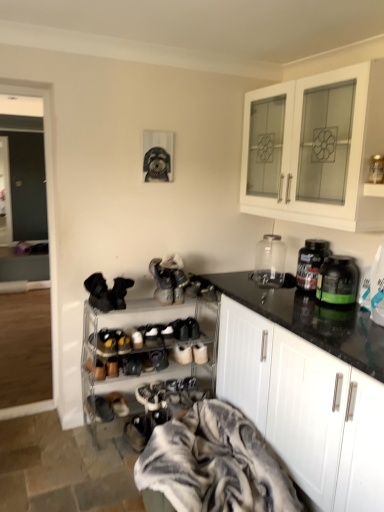
Question: Is metallic silver shoe rack at lower center shorter than white suede shoe at lower center, which is counted as the first shoe, starting from the bottom?

Choices:
 (A) yes
 (B) no

Answer: (B)

Question: Is metallic silver shoe rack at lower center not within white suede shoe at lower center, which is counted as the first shoe, starting from the bottom?

Choices:
 (A) no
 (B) yes

Answer: (B)

Question: Considering the relative sizes of metallic silver shoe rack at lower center and white suede shoe at lower center, which is counted as the first shoe, starting from the bottom, in the image provided, is metallic silver shoe rack at lower center wider than white suede shoe at lower center, which is counted as the first shoe, starting from the bottom,?

Choices:
 (A) yes
 (B) no

Answer: (A)

Question: Is metallic silver shoe rack at lower center positioned with its back to white suede shoe at lower center, which is counted as the first shoe, starting from the bottom?

Choices:
 (A) no
 (B) yes

Answer: (B)

Question: Is metallic silver shoe rack at lower center far from white suede shoe at lower center, the 6th shoe from the top?

Choices:
 (A) yes
 (B) no

Answer: (B)

Question: Is the position of metallic silver shoe rack at lower center less distant than that of white suede shoe at lower center, which is counted as the first shoe, starting from the bottom?

Choices:
 (A) no
 (B) yes

Answer: (B)

Question: Can you confirm if translucent plastic bottle at right, the 2th bottle viewed from the front, is positioned to the left of brown suede shoes at lower center, which is counted as the 3th footwear, starting from the bottom?

Choices:
 (A) yes
 (B) no

Answer: (B)

Question: Does translucent plastic bottle at right, the 2th bottle viewed from the front, come behind brown suede shoes at lower center, acting as the 3th footwear starting from the top?

Choices:
 (A) yes
 (B) no

Answer: (B)

Question: Is translucent plastic bottle at right, the 2th bottle viewed from the front, next to brown suede shoes at lower center, marked as the fourth footwear in a right-to-left arrangement?

Choices:
 (A) yes
 (B) no

Answer: (B)

Question: Considering the relative sizes of translucent plastic bottle at right, positioned as the first bottle in back-to-front order, and brown suede shoes at lower center, acting as the 3th footwear starting from the top, in the image provided, is translucent plastic bottle at right, positioned as the first bottle in back-to-front order, bigger than brown suede shoes at lower center, acting as the 3th footwear starting from the top,?

Choices:
 (A) yes
 (B) no

Answer: (A)

Question: Considering the relative sizes of translucent plastic bottle at right, positioned as the first bottle in back-to-front order, and brown suede shoes at lower center, which ranks as the second footwear in left-to-right order, in the image provided, is translucent plastic bottle at right, positioned as the first bottle in back-to-front order, wider than brown suede shoes at lower center, which ranks as the second footwear in left-to-right order,?

Choices:
 (A) yes
 (B) no

Answer: (B)

Question: Is translucent plastic bottle at right, positioned as the first bottle in back-to-front order, thinner than brown suede shoes at lower center, acting as the 3th footwear starting from the top?

Choices:
 (A) no
 (B) yes

Answer: (B)

Question: Considering the relative positions of white glossy cabinet at upper right, which ranks as the 2th cabinetry in bottom-to-top order, and green plastic jar at right, placed as the first bottle when sorted from front to back, in the image provided, is white glossy cabinet at upper right, which ranks as the 2th cabinetry in bottom-to-top order, to the right of green plastic jar at right, placed as the first bottle when sorted from front to back, from the viewer's perspective?

Choices:
 (A) yes
 (B) no

Answer: (B)